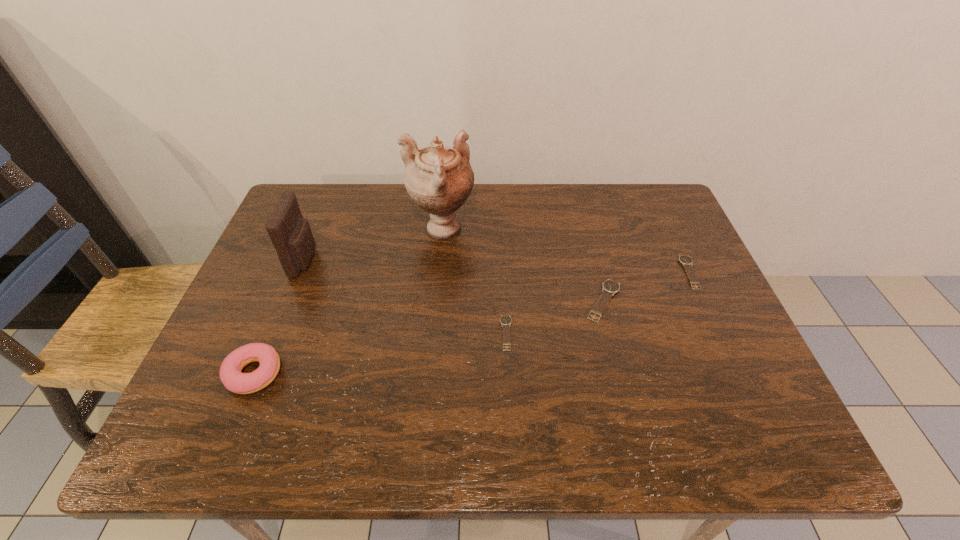
Image resolution: width=960 pixels, height=540 pixels. What are the coordinates of `empty space between the shortest object and the second watch from left to right` in the screenshot? It's located at (555, 317).

Identify the location of empty space between the third object from right to left and the fourth object from right to left. This screenshot has height=540, width=960. (473, 281).

The height and width of the screenshot is (540, 960). I want to click on vacant area that lies between the fifth shortest object and the fourth tallest object, so click(x=454, y=280).

The height and width of the screenshot is (540, 960). Find the location of `free space between the second object from right to left and the pouch`. free space between the second object from right to left and the pouch is located at coordinates (454, 280).

The width and height of the screenshot is (960, 540). In order to click on vacant area that lies between the urn and the leftmost watch in this screenshot , I will do `click(473, 281)`.

Find the location of a particular element. The height and width of the screenshot is (540, 960). free space between the third tallest object and the fourth tallest object is located at coordinates (429, 337).

You are a GUI agent. You are given a task and a screenshot of the screen. Output one action in this format:
    pyautogui.click(x=<x>, y=<y>)
    Task: Click on the vacant area that lies between the doughnut and the rightmost object
    Image resolution: width=960 pixels, height=540 pixels.
    Given the screenshot: What is the action you would take?
    pyautogui.click(x=471, y=323)

Identify which object is the nearest to the leftmost watch. Please provide its 2D coordinates. Your answer should be formatted as a tuple, i.e. [(x, y)], where the tuple contains the x and y coordinates of a point satisfying the conditions above.

[(609, 287)]

Identify which object is the second nearest to the urn. Please provide its 2D coordinates. Your answer should be formatted as a tuple, i.e. [(x, y)], where the tuple contains the x and y coordinates of a point satisfying the conditions above.

[(291, 235)]

At what (x,y) coordinates should I click in order to perform the action: click on the second closest watch relative to the leftmost watch. Please return your answer as a coordinate pair (x, y). Looking at the image, I should click on (685, 260).